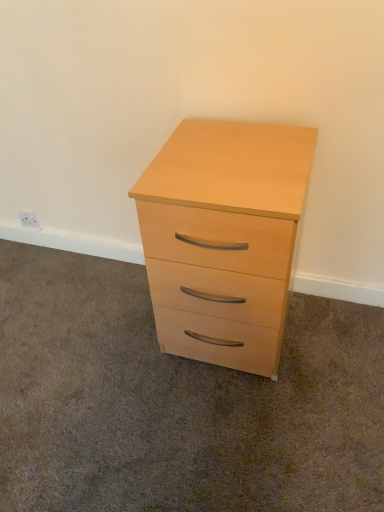
Identify the location of light wood chest of drawers at center. (225, 233).

This screenshot has width=384, height=512. What do you see at coordinates (225, 233) in the screenshot?
I see `light wood chest of drawers at center` at bounding box center [225, 233].

What do you see at coordinates (177, 401) in the screenshot? I see `light wood drawer at center` at bounding box center [177, 401].

This screenshot has width=384, height=512. What are the coordinates of `light wood drawer at center` in the screenshot? It's located at (177, 401).

Measure the distance between point [189,445] and camera.

1.21 meters.

In order to face light wood drawer at center, should I rotate leftwards or rightwards?

Turn left approximately 9.646 degrees to face it.

What is the approximate height of light wood drawer at center?

light wood drawer at center is 1.70 inches tall.

The image size is (384, 512). I want to click on light wood chest of drawers at center, so click(x=225, y=233).

Can you confirm if light wood chest of drawers at center is positioned to the left of light wood drawer at center?

No.

Is the depth of light wood chest of drawers at center greater than that of light wood drawer at center?

Yes, it is.

Does point (186, 204) appear closer or farther from the camera than point (70, 410)?

Point (186, 204).

From the image's perspective, is light wood chest of drawers at center under light wood drawer at center?

Actually, light wood chest of drawers at center appears above light wood drawer at center in the image.

From a real-world perspective, is light wood chest of drawers at center physically located above or below light wood drawer at center?

light wood chest of drawers at center is situated higher than light wood drawer at center in the real world.

Is light wood chest of drawers at center wider than light wood drawer at center?

Incorrect, the width of light wood chest of drawers at center does not surpass that of light wood drawer at center.

Is light wood chest of drawers at center taller than light wood drawer at center?

Indeed, light wood chest of drawers at center has a greater height compared to light wood drawer at center.

Considering the relative sizes of light wood chest of drawers at center and light wood drawer at center in the image provided, is light wood chest of drawers at center smaller than light wood drawer at center?

Actually, light wood chest of drawers at center might be larger than light wood drawer at center.

Is light wood chest of drawers at center situated inside light wood drawer at center or outside?

light wood chest of drawers at center is outside light wood drawer at center.

Are light wood chest of drawers at center and light wood drawer at center far apart?

That's not correct — light wood chest of drawers at center is a little close to light wood drawer at center.

Is light wood chest of drawers at center facing away from light wood drawer at center?

No, light wood chest of drawers at center's orientation is not away from light wood drawer at center.

Measure the distance between light wood chest of drawers at center and light wood drawer at center.

light wood chest of drawers at center is 16.38 inches away from light wood drawer at center.

At what (x,y) coordinates should I click in order to perform the action: click on chest of drawers located on the right of light wood drawer at center. Please return your answer as a coordinate pair (x, y). Looking at the image, I should click on (225, 233).

Which object is positioned more to the right, light wood drawer at center or light wood chest of drawers at center?

From the viewer's perspective, light wood chest of drawers at center appears more on the right side.

Relative to light wood chest of drawers at center, is light wood drawer at center in front or behind?

light wood drawer at center is positioned closer to the viewer than light wood chest of drawers at center.

Is point (3, 405) positioned in front of point (208, 326)?

No, (3, 405) is further to viewer.

From the image's perspective, does light wood drawer at center appear lower than light wood chest of drawers at center?

Correct, light wood drawer at center appears lower than light wood chest of drawers at center in the image.

From a real-world perspective, is light wood drawer at center physically below light wood chest of drawers at center?

Yes.

Does light wood drawer at center have a greater width compared to light wood chest of drawers at center?

Indeed, light wood drawer at center has a greater width compared to light wood chest of drawers at center.

Who is shorter, light wood drawer at center or light wood chest of drawers at center?

light wood drawer at center is shorter.

Is light wood drawer at center smaller than light wood chest of drawers at center?

Yes.

Is light wood chest of drawers at center surrounded by light wood drawer at center?

No, light wood chest of drawers at center is not a part of light wood drawer at center.

Is light wood drawer at center in contact with light wood chest of drawers at center?

There is a gap between light wood drawer at center and light wood chest of drawers at center.

Does light wood drawer at center turn towards light wood chest of drawers at center?

No, light wood drawer at center is not turned towards light wood chest of drawers at center.

How different are the orientations of light wood drawer at center and light wood chest of drawers at center in degrees?

89.3 degrees separate the facing orientations of light wood drawer at center and light wood chest of drawers at center.

In the image, there is a light wood chest of drawers at center. In order to click on plain below it (from the image's perspective) in this screenshot , I will do `click(177, 401)`.

In order to click on the chest of drawers lying behind the light wood drawer at center in this screenshot , I will do `click(225, 233)`.

Where is `plain that is on the left side of light wood chest of drawers at center`? The image size is (384, 512). plain that is on the left side of light wood chest of drawers at center is located at coordinates (177, 401).